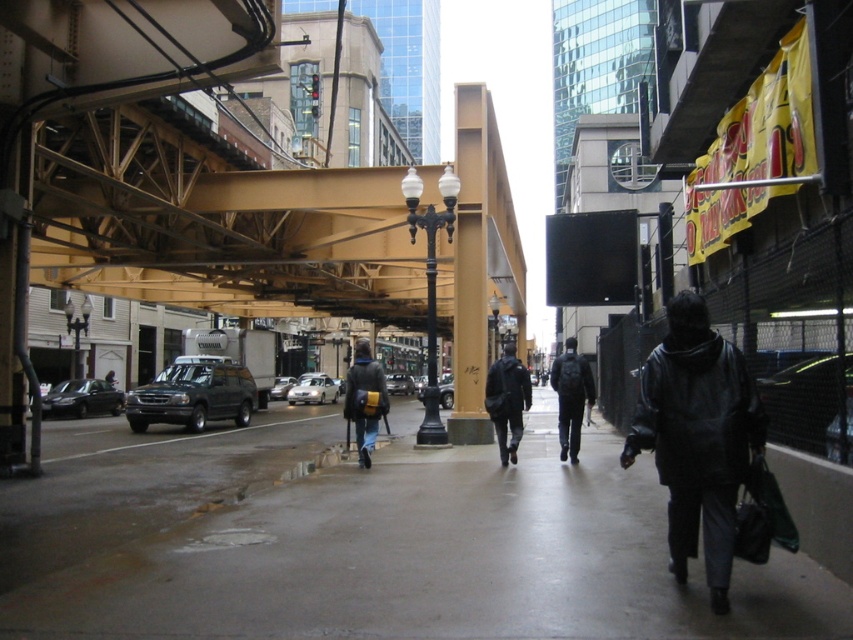
Consider the image. Is dark green matte suv at center-left to the left of dark gray jacket at center from the viewer's perspective?

Yes, dark green matte suv at center-left is to the left of dark gray jacket at center.

Is point (177, 403) closer to viewer compared to point (514, 454)?

No, (177, 403) is further to viewer.

Is point (144, 396) closer to camera compared to point (511, 356)?

No, it is not.

Locate an element on the screen. Image resolution: width=853 pixels, height=640 pixels. dark green matte suv at center-left is located at coordinates (193, 396).

Is matte black suv at center in front of silver metallic suv at center?

No, matte black suv at center is behind silver metallic suv at center.

Does point (405, 388) come behind point (285, 378)?

Yes, it is behind point (285, 378).

Does point (412, 380) come closer to viewer compared to point (280, 376)?

No, it is behind (280, 376).

Identify the location of matte black suv at center. This screenshot has width=853, height=640. coord(399,384).

Does matte black jacket at center appear on the right side of silver metallic suv at center?

Yes, matte black jacket at center is to the right of silver metallic suv at center.

Between matte black jacket at center and silver metallic suv at center, which one appears on the left side from the viewer's perspective?

silver metallic suv at center is more to the left.

Is point (366, 438) positioned behind point (280, 394)?

No, (366, 438) is closer to viewer.

This screenshot has height=640, width=853. I want to click on matte black jacket at center, so click(364, 400).